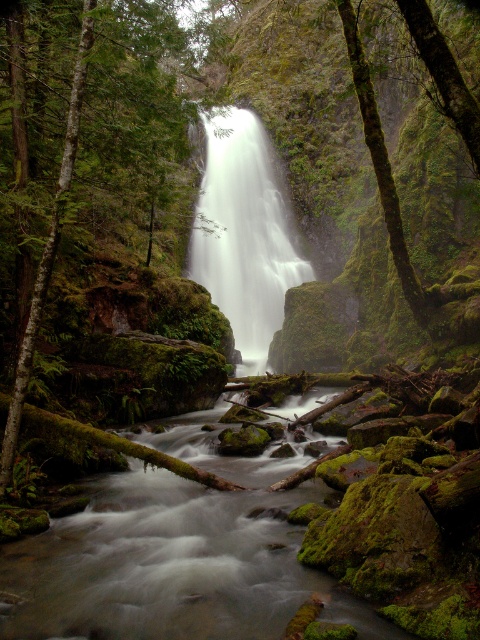
What do you see at coordinates (243, 232) in the screenshot?
I see `white smooth waterfall at center` at bounding box center [243, 232].

Is point (244, 342) positioned behind point (74, 67)?

That is True.

The width and height of the screenshot is (480, 640). Describe the element at coordinates (243, 232) in the screenshot. I see `white smooth waterfall at center` at that location.

Find the location of `white smooth waterfall at center`. white smooth waterfall at center is located at coordinates (243, 232).